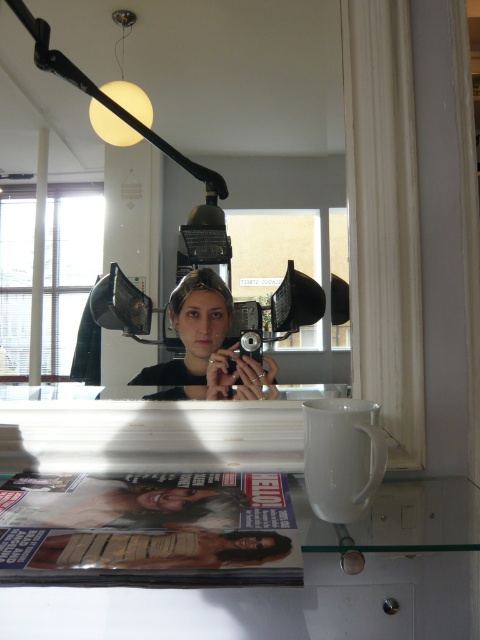
You are setting up a camera in the studio and need to position it so that it can capture both the white glossy mirror at upper center and the woman reflected in the mirror. Based on the mirror location, where should you place the camera relative to the mirror?

The white glossy mirror at upper center is located at point (242, 76). To capture both the mirror and the woman reflected in it, the camera should be positioned in front of the mirror at an angle that allows it to see the mirror and the reflected image of the woman holding the camera.

You are a photographer setting up for a self portrait. You have a camera and want to position yourself so that your reflection in the white glossy mirror at upper center is centered in your camera frame. The distance between you and the mirror is 37.67 inches. What is the minimum distance you should stand from the mirror to ensure your reflection is fully visible in the frame?

The minimum distance you should stand from the mirror is half of 37.67 inches, which is approximately 18.83 inches. This ensures your reflection is centered and fully visible in the camera frame.

You are organizing a photography exhibition and need to place the matte plastic magazine at lower center and the white glossy mirror at upper center on a shelf. The shelf has limited space. Can you determine which object is closer to the edge of the shelf based on their positions in the original image?

The matte plastic magazine at lower center is positioned under the white glossy mirror at upper center, meaning it is closer to the edge of the shelf since it is lower in position.